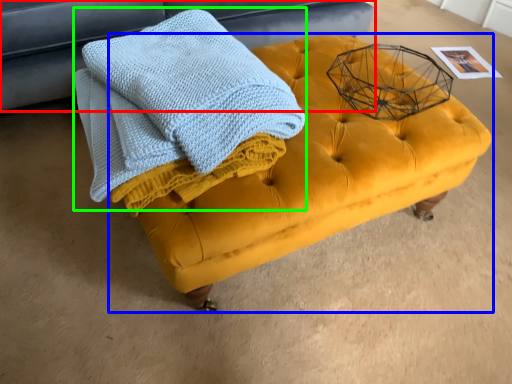
Question: Considering the real-world distances, which object is farthest from furniture (highlighted by a red box)? table (highlighted by a blue box) or bath towel (highlighted by a green box)?

Choices:
 (A) table
 (B) bath towel

Answer: (A)